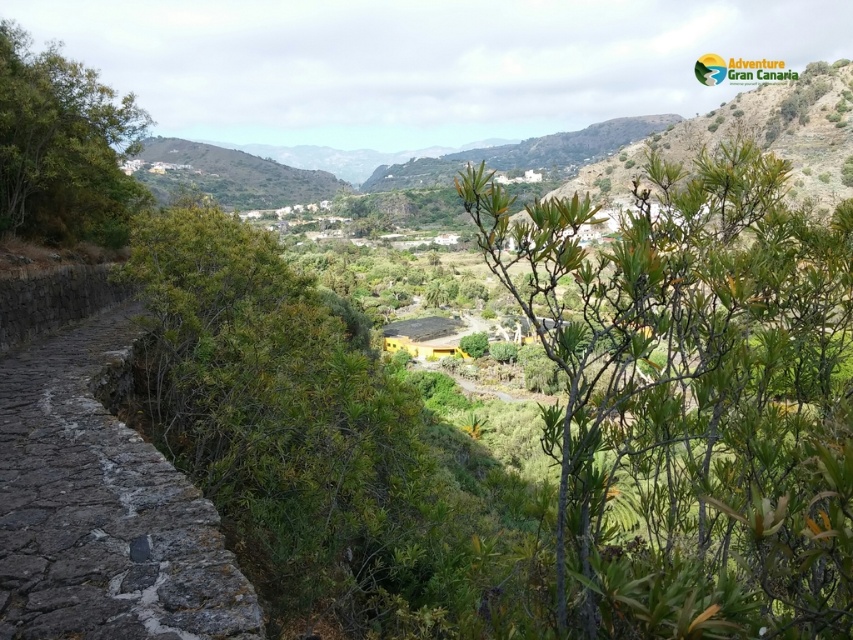
Which is more to the left, green leafy shrub at center or green leafy shrub at upper left?

From the viewer's perspective, green leafy shrub at upper left appears more on the left side.

Can you confirm if green leafy shrub at center is taller than green leafy shrub at upper left?

Yes, green leafy shrub at center is taller than green leafy shrub at upper left.

Does point (479, 211) lie behind point (16, 182)?

No, it is not.

Locate an element on the screen. The height and width of the screenshot is (640, 853). green leafy shrub at center is located at coordinates 693,400.

Is green leafy shrub at center thinner than dark gray cobblestone path at center?

No, green leafy shrub at center is not thinner than dark gray cobblestone path at center.

Does point (733, 548) come farther from viewer compared to point (134, 563)?

Yes, it is behind point (134, 563).

Measure the distance between green leafy shrub at center and camera.

green leafy shrub at center and camera are 2.58 meters apart from each other.

Where is `green leafy shrub at center`? green leafy shrub at center is located at coordinates (693, 400).

Can you confirm if dark gray cobblestone path at center is positioned above green leafy shrub at upper left?

No.

Does dark gray cobblestone path at center have a greater height compared to green leafy shrub at upper left?

No.

Identify the location of dark gray cobblestone path at center. The image size is (853, 640). (102, 509).